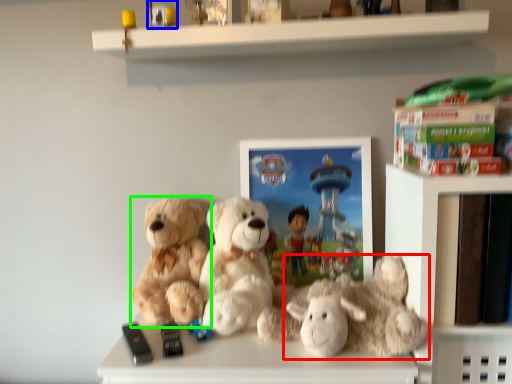
Question: Which is farther away from teddy bear (highlighted by a red box)? toy (highlighted by a blue box) or teddy bear (highlighted by a green box)?

Choices:
 (A) toy
 (B) teddy bear

Answer: (A)